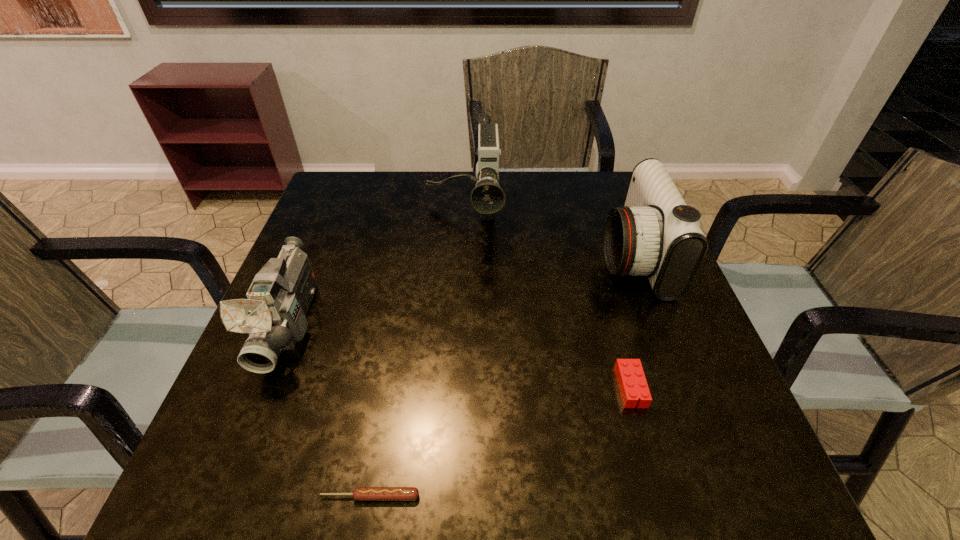
Identify the location of free space located on the front-facing side of the leftmost camcorder. (241, 449).

Where is `vacant space located on the left of the fourth tallest object`? This screenshot has width=960, height=540. vacant space located on the left of the fourth tallest object is located at coordinates (418, 387).

The width and height of the screenshot is (960, 540). I want to click on vacant space situated on the right of the nearest object, so click(x=507, y=496).

In order to click on object present at the near edge in this screenshot , I will do `click(360, 493)`.

The image size is (960, 540). I want to click on object present at the left edge, so [274, 315].

Locate an element on the screen. The width and height of the screenshot is (960, 540). camcorder present at the right edge is located at coordinates tap(656, 234).

Where is `Lego situated at the right edge`? This screenshot has height=540, width=960. Lego situated at the right edge is located at coordinates (632, 383).

The height and width of the screenshot is (540, 960). Identify the location of object located in the far right corner section of the desktop. (656, 234).

This screenshot has width=960, height=540. I want to click on vacant space at the far edge, so coord(518,173).

The height and width of the screenshot is (540, 960). In the image, there is a desktop. What are the coordinates of `free space at the near edge` in the screenshot? It's located at pyautogui.click(x=312, y=504).